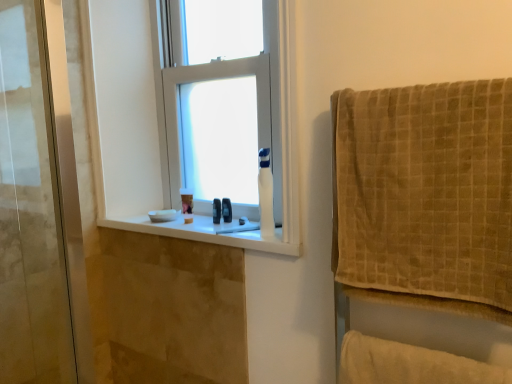
Identify the location of empty space that is ontop of white glossy window sill at center (from a real-world perspective). The height and width of the screenshot is (384, 512). (203, 226).